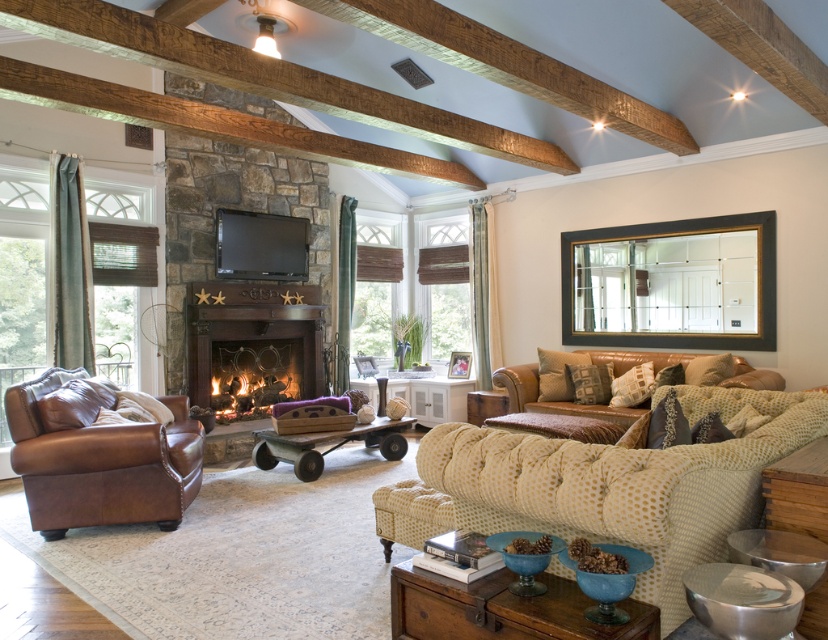
You are planning to place a new coffee table in the living room. The coffee table you have is the same size as the wooden wagon at center. Will the brown leather armchair at left fit comfortably next to it without feeling cramped?

The brown leather armchair at left is bigger than the wooden wagon at center. Since the coffee table is the same size as the wooden wagon at center, the armchair may not fit comfortably next to it due to its larger size, potentially causing a cramped feel.

Consider the image. You are sitting on the wooden wagon at center and want to move to the leather couch at right. Which direction should you move in to reach it?

The leather couch at right is above the wooden wagon at center, so you should move upward to reach it.